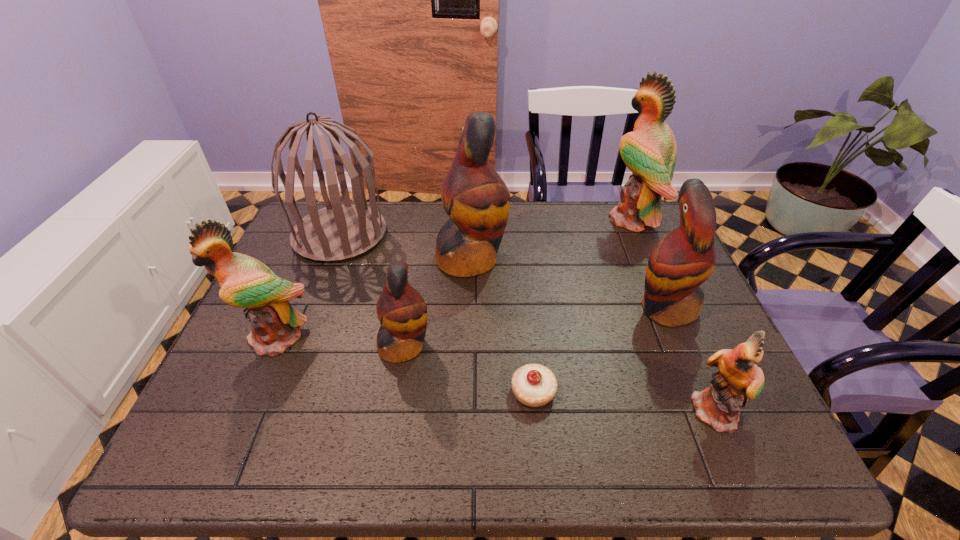
What are the coordinates of `the smallest green parrot` in the screenshot? It's located at (739, 378).

Locate an element on the screen. The width and height of the screenshot is (960, 540). the nearest green parrot is located at coordinates (739, 378).

Find the location of a particular element. Image resolution: width=960 pixels, height=540 pixels. beige pastry is located at coordinates (534, 385).

Identify the location of pastry. (534, 385).

Where is `free space located 0.310m on the front-facing side of the farthest green parrot`? free space located 0.310m on the front-facing side of the farthest green parrot is located at coordinates (511, 219).

Where is `free space located 0.220m on the front-facing side of the farthest green parrot`? This screenshot has width=960, height=540. free space located 0.220m on the front-facing side of the farthest green parrot is located at coordinates (538, 219).

Image resolution: width=960 pixels, height=540 pixels. Identify the location of vacant space located 0.320m on the front-facing side of the farthest green parrot. (507, 219).

Identify the location of vacant space situated 0.310m on the face of the farthest red parrot. 613,259.

The image size is (960, 540). Find the location of `vacant space located 0.390m on the front of the brown birdcage`. vacant space located 0.390m on the front of the brown birdcage is located at coordinates (284, 381).

At what (x,y) coordinates should I click in order to perform the action: click on free location located 0.230m on the face of the second biggest red parrot. Please return your answer as a coordinate pair (x, y). This screenshot has height=540, width=960. Looking at the image, I should click on (544, 308).